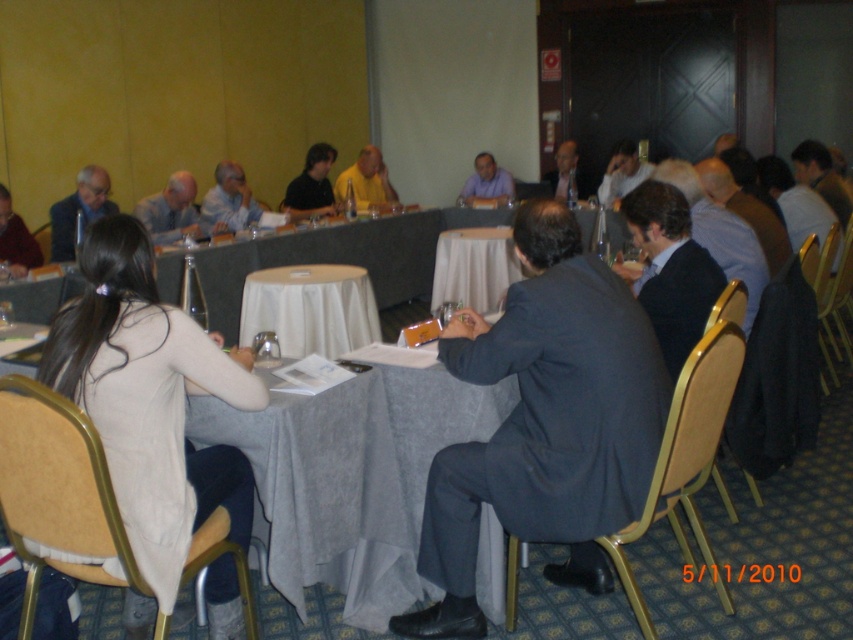
You are standing at the entrance of the conference room and see two points marked on the floor. The first point is at coordinate point (718, 168) and the second is at point (213, 211). Which point is closer to you?

Point (718, 168) is closer to the viewer than point (213, 211).

You are standing in the room and want to reach a specific point marked at coordinates point (737, 241). If you can walk 12 feet per minute, how long will it take you to reach that point?

The distance of point (737, 241) from viewer is 10.87 feet. At a walking speed of 12 feet per minute, it would take approximately 0.906 minutes, which is about 54 seconds, to reach the point.